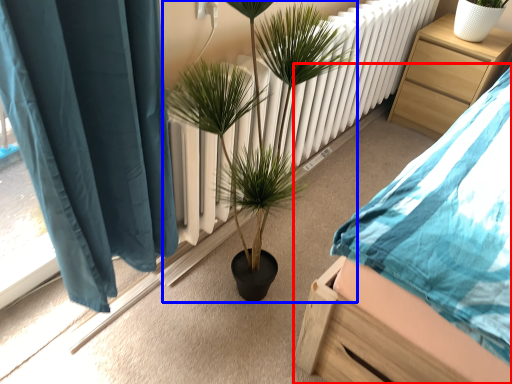
Question: Which object appears farthest to the camera in this image, bed (highlighted by a red box) or houseplant (highlighted by a blue box)?

Choices:
 (A) bed
 (B) houseplant

Answer: (B)